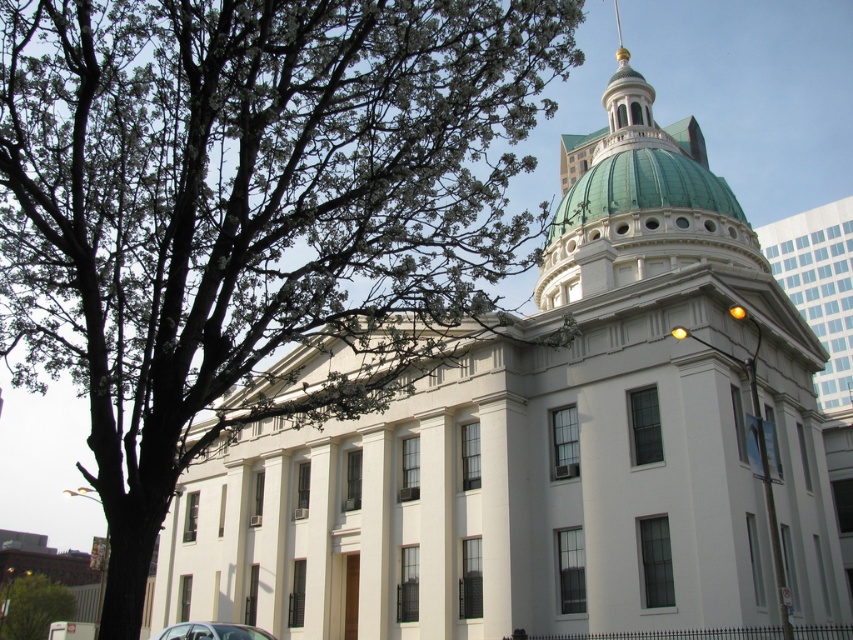
Consider the image. You are a photographer planning to take a picture of the grand building with the green leafy tree at upper left and the metallic silver car at lower left in the frame. Which object should be placed closer to the left edge of the photo to maintain their natural positions?

The green leafy tree at upper left should be placed closer to the left edge of the photo because it is positioned on the left side of the metallic silver car at lower left.

You are a visitor trying to find the entrance to the grand neoclassical building with a dome. You see a green leafy tree at lower left and a metallic silver car at lower left. Which object is closer to the building entrance?

The green leafy tree at lower left is positioned on the left side of metallic silver car at lower left, so the tree is closer to the building entrance than the car.